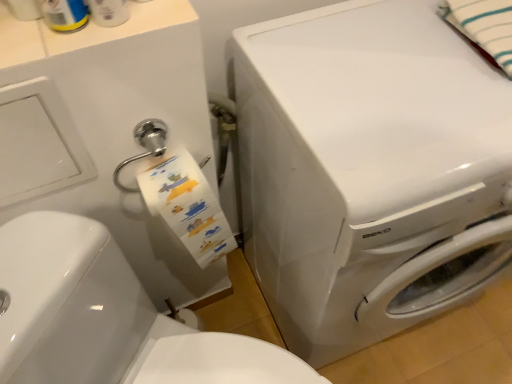
Question: Is white glossy washing machine at center wider than white striped fabric at upper right?

Choices:
 (A) yes
 (B) no

Answer: (A)

Question: Is white striped fabric at upper right inside white glossy washing machine at center?

Choices:
 (A) yes
 (B) no

Answer: (B)

Question: Is white glossy washing machine at center taller than white striped fabric at upper right?

Choices:
 (A) no
 (B) yes

Answer: (B)

Question: Is white glossy washing machine at center placed right next to white striped fabric at upper right?

Choices:
 (A) no
 (B) yes

Answer: (A)

Question: Does white glossy washing machine at center have a lesser height compared to white striped fabric at upper right?

Choices:
 (A) no
 (B) yes

Answer: (A)

Question: From a real-world perspective, does white glossy washing machine at center sit lower than white striped fabric at upper right?

Choices:
 (A) yes
 (B) no

Answer: (A)

Question: Considering the relative sizes of white glossy washer at center and white glossy washing machine at center in the image provided, is white glossy washer at center thinner than white glossy washing machine at center?

Choices:
 (A) yes
 (B) no

Answer: (B)

Question: From a real-world perspective, is white glossy washer at center on white glossy washing machine at center?

Choices:
 (A) yes
 (B) no

Answer: (B)

Question: Considering the relative positions of white glossy washer at center and white glossy washing machine at center in the image provided, is white glossy washer at center to the left of white glossy washing machine at center from the viewer's perspective?

Choices:
 (A) yes
 (B) no

Answer: (A)

Question: Is white glossy washer at center located outside white glossy washing machine at center?

Choices:
 (A) yes
 (B) no

Answer: (A)

Question: Would you say white glossy washing machine at center is part of white glossy washer at center's contents?

Choices:
 (A) yes
 (B) no

Answer: (B)

Question: Can you confirm if white glossy washer at center is bigger than white glossy washing machine at center?

Choices:
 (A) no
 (B) yes

Answer: (A)

Question: Is white striped fabric at upper right to the right of white glossy washing machine at center from the viewer's perspective?

Choices:
 (A) no
 (B) yes

Answer: (B)